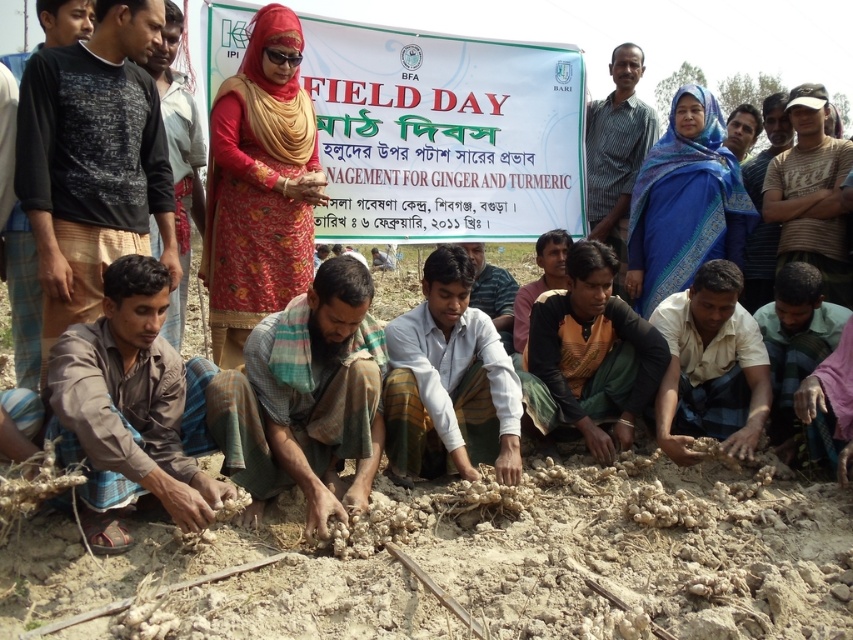
What do you see at coordinates (131, 408) in the screenshot? The height and width of the screenshot is (640, 853). I see `brown woven cloth at lower left` at bounding box center [131, 408].

Is brown woven cloth at lower left to the left of dark green fabric at center from the viewer's perspective?

Yes, brown woven cloth at lower left is to the left of dark green fabric at center.

Which is in front, point (62, 381) or point (635, 417)?

Point (62, 381) is more forward.

At what (x,y) coordinates should I click in order to perform the action: click on brown woven cloth at lower left. Please return your answer as a coordinate pair (x, y). Looking at the image, I should click on [131, 408].

Identify the location of brown woven cloth at lower left. click(131, 408).

Is point (61, 358) positioned before point (457, 340)?

Yes, point (61, 358) is in front of point (457, 340).

At what (x,y) coordinates should I click in order to perform the action: click on brown woven cloth at lower left. Please return your answer as a coordinate pair (x, y). Looking at the image, I should click on (131, 408).

Consider the image. Is white paper banner at center in front of brown fabric shirt at center?

No, white paper banner at center is further to the viewer.

This screenshot has width=853, height=640. Describe the element at coordinates (444, 134) in the screenshot. I see `white paper banner at center` at that location.

Identify the location of white paper banner at center. Image resolution: width=853 pixels, height=640 pixels. (444, 134).